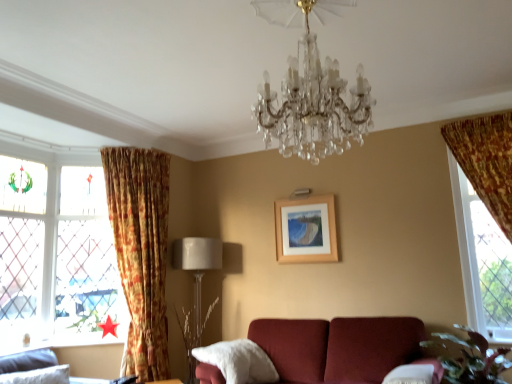
Measure the distance between wooden frame at center and camera.

wooden frame at center and camera are 4.11 meters apart.

What do you see at coordinates (44, 368) in the screenshot? This screenshot has height=384, width=512. I see `velvet gray sofa at lower left` at bounding box center [44, 368].

You are a GUI agent. You are given a task and a screenshot of the screen. Output one action in this format:
    pyautogui.click(x=<x>, y=<y>)
    Task: Click on the clear crystal chandelier at center
    This screenshot has height=384, width=512.
    Given the screenshot: What is the action you would take?
    pyautogui.click(x=311, y=90)

Based on the photo, measure the distance between point (102, 227) and camera.

Point (102, 227) is 14.07 feet from camera.

Find the location of `wooden frame at center`. wooden frame at center is located at coordinates (306, 230).

In the scene shown: Considering the relative positions of white fluffy pillow at lower center and stained glass window at left, which is counted as the first window, starting from the left, in the image provided, is white fluffy pillow at lower center in front of stained glass window at left, which is counted as the first window, starting from the left,?

Yes, white fluffy pillow at lower center is closer to the viewer.

Locate an element on the screen. This screenshot has height=384, width=512. window to the left of white fluffy pillow at lower center is located at coordinates (59, 260).

From the picture: Considering the sizes of objects white fluffy pillow at lower center and stained glass window at left, which is counted as the first window, starting from the left, in the image provided, who is bigger, white fluffy pillow at lower center or stained glass window at left, which is counted as the first window, starting from the left,?

With larger size is white fluffy pillow at lower center.

Is wooden frame at center oriented away from stained glass window at left, which is counted as the first window, starting from the left?

wooden frame at center does not have its back to stained glass window at left, which is counted as the first window, starting from the left.

Between wooden frame at center and stained glass window at left, which is the 2th window from right to left, which one is positioned in front?

stained glass window at left, which is the 2th window from right to left, is closer to the camera.

Choose the correct answer: Is wooden frame at center inside stained glass window at left, which is the 2th window from right to left, or outside it?

The correct answer is: outside.

Considering the relative sizes of wooden frame at center and stained glass window at left, which is the 2th window from right to left, in the image provided, is wooden frame at center wider than stained glass window at left, which is the 2th window from right to left,?

No.

How many degrees apart are the facing directions of wooden frame at center and clear glass window at right, marked as the first window in a front-to-back arrangement?

0.229 degrees separate the facing orientations of wooden frame at center and clear glass window at right, marked as the first window in a front-to-back arrangement.

Is wooden frame at center aimed at clear glass window at right, the 1th window in the right-to-left sequence?

No, wooden frame at center is not turned towards clear glass window at right, the 1th window in the right-to-left sequence.

Is wooden frame at center at the right side of clear glass window at right, the 1th window in the right-to-left sequence?

No.

Between clear crystal chandelier at center and stained glass window at left, positioned as the first window in back-to-front order, which one has smaller width?

Thinner between the two is stained glass window at left, positioned as the first window in back-to-front order.

Would you consider clear crystal chandelier at center to be distant from stained glass window at left, which is counted as the first window, starting from the left?

Yes, clear crystal chandelier at center and stained glass window at left, which is counted as the first window, starting from the left, are quite far apart.

From a real-world perspective, is clear crystal chandelier at center physically located above or below stained glass window at left, which is the 2th window from right to left?

clear crystal chandelier at center is above stained glass window at left, which is the 2th window from right to left.

Which is farther from the camera, (508,279) or (265,105)?

The point (508,279) is behind.

From the image's perspective, is clear glass window at right, acting as the second window starting from the back, below clear crystal chandelier at center?

Yes, from the image's perspective, clear glass window at right, acting as the second window starting from the back, is beneath clear crystal chandelier at center.

Can you confirm if clear glass window at right, which appears as the second window when viewed from the left, is thinner than clear crystal chandelier at center?

Correct, the width of clear glass window at right, which appears as the second window when viewed from the left, is less than that of clear crystal chandelier at center.

At what (x,y) coordinates should I click in order to perform the action: click on chandelier that is in front of the clear glass window at right, the 1th window in the right-to-left sequence. Please return your answer as a coordinate pair (x, y). Looking at the image, I should click on (311, 90).

Considering the sizes of floral fabric curtain at left and wooden frame at center in the image, is floral fabric curtain at left wider or thinner than wooden frame at center?

floral fabric curtain at left is wider than wooden frame at center.

Does point (133, 335) come closer to viewer compared to point (276, 224)?

Yes, point (133, 335) is in front of point (276, 224).

How much distance is there between floral fabric curtain at left and wooden frame at center?

floral fabric curtain at left is 1.43 meters from wooden frame at center.

Is floral fabric curtain at left closer to camera compared to wooden frame at center?

Yes, floral fabric curtain at left is in front of wooden frame at center.

The image size is (512, 384). In order to click on the 1st window above the beige fabric lampshade at lower left (from the image's perspective) in this screenshot , I will do `click(59, 260)`.

Is beige fabric lampshade at lower left oriented towards stained glass window at left, which is counted as the first window, starting from the left?

No, beige fabric lampshade at lower left does not turn towards stained glass window at left, which is counted as the first window, starting from the left.

Is beige fabric lampshade at lower left inside or outside of stained glass window at left, positioned as the first window in back-to-front order?

The correct answer is: outside.

Considering the sizes of objects beige fabric lampshade at lower left and stained glass window at left, positioned as the first window in back-to-front order, in the image provided, who is shorter, beige fabric lampshade at lower left or stained glass window at left, positioned as the first window in back-to-front order,?

With less height is beige fabric lampshade at lower left.

The width and height of the screenshot is (512, 384). There is a white fluffy pillow at lower center. Find the location of `the 1st window above it (from the image's perspective)`. the 1st window above it (from the image's perspective) is located at coordinates (59, 260).

You are a GUI agent. You are given a task and a screenshot of the screen. Output one action in this format:
    pyautogui.click(x=<x>, y=<y>)
    Task: Click on the window below the wooden frame at center (from the image's perspective)
    The width and height of the screenshot is (512, 384).
    Given the screenshot: What is the action you would take?
    pyautogui.click(x=59, y=260)

Looking at the image, which one is located closer to white fluffy pillow at lower center, velvet gray sofa at lower left or clear crystal chandelier at center?

velvet gray sofa at lower left.

Which object lies nearer to the anchor point white fluffy pillow at lower center, velvet gray sofa at lower left or stained glass window at left, which is counted as the first window, starting from the left?

The object closer to white fluffy pillow at lower center is velvet gray sofa at lower left.

From the image, which object appears to be nearer to wooden frame at center, beige fabric lampshade at lower left or velvet gray sofa at lower left?

Based on the image, beige fabric lampshade at lower left appears to be nearer to wooden frame at center.

In the scene shown: Estimate the real-world distances between objects in this image. Which object is closer to velvet gray sofa at lower left, stained glass window at left, positioned as the first window in back-to-front order, or floral fabric curtain at left?

stained glass window at left, positioned as the first window in back-to-front order, lies closer to velvet gray sofa at lower left than the other object.

From the image, which object appears to be farther from clear glass window at right, which appears as the second window when viewed from the left, stained glass window at left, positioned as the first window in back-to-front order, or white fluffy pillow at lower center?

stained glass window at left, positioned as the first window in back-to-front order, is further to clear glass window at right, which appears as the second window when viewed from the left.

From the picture: From the image, which object appears to be nearer to floral fabric curtain at left, velvet gray sofa at lower left or clear glass window at right, the 1th window in the right-to-left sequence?

Among the two, velvet gray sofa at lower left is located nearer to floral fabric curtain at left.

Estimate the real-world distances between objects in this image. Which object is closer to clear crystal chandelier at center, stained glass window at left, which is the 2th window from right to left, or velvet gray sofa at lower left?

velvet gray sofa at lower left lies closer to clear crystal chandelier at center than the other object.

Looking at the image, which one is located further to floral fabric curtain at left, clear crystal chandelier at center or velvet gray sofa at lower left?

Among the two, clear crystal chandelier at center is located further to floral fabric curtain at left.

This screenshot has height=384, width=512. I want to click on curtain between clear crystal chandelier at center and stained glass window at left, positioned as the first window in back-to-front order, in the front-back direction, so click(x=141, y=251).

At what (x,y) coordinates should I click in order to perform the action: click on pillow between velvet gray sofa at lower left and stained glass window at left, positioned as the first window in back-to-front order, from front to back. Please return your answer as a coordinate pair (x, y). Image resolution: width=512 pixels, height=384 pixels. Looking at the image, I should click on (239, 361).

You are a GUI agent. You are given a task and a screenshot of the screen. Output one action in this format:
    pyautogui.click(x=<x>, y=<y>)
    Task: Click on the lamp between velvet gray sofa at lower left and wooden frame at center along the z-axis
    The height and width of the screenshot is (384, 512).
    Given the screenshot: What is the action you would take?
    pyautogui.click(x=196, y=285)

Where is `chandelier located between white fluffy pillow at lower center and clear glass window at right, the 1th window in the right-to-left sequence, in the left-right direction`? chandelier located between white fluffy pillow at lower center and clear glass window at right, the 1th window in the right-to-left sequence, in the left-right direction is located at coordinates (311, 90).